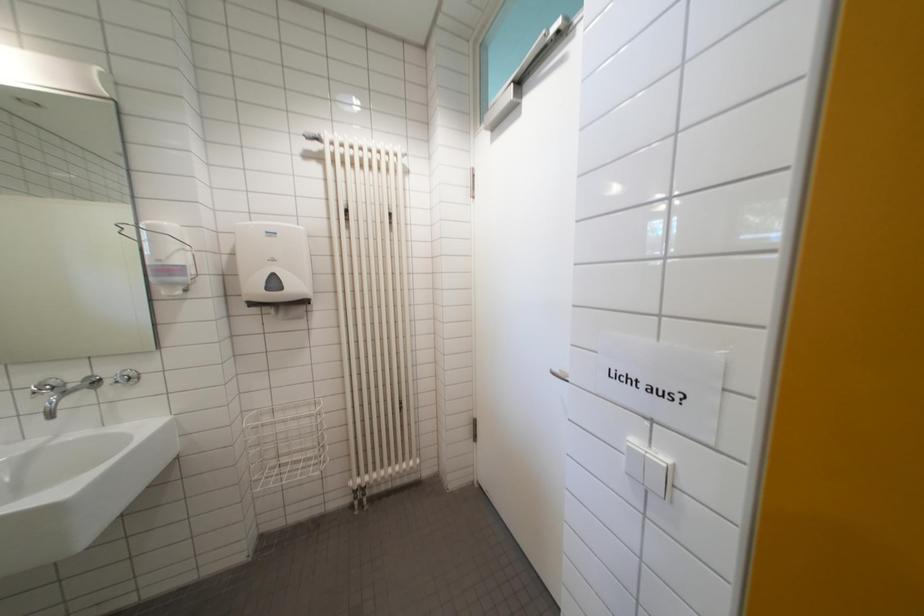
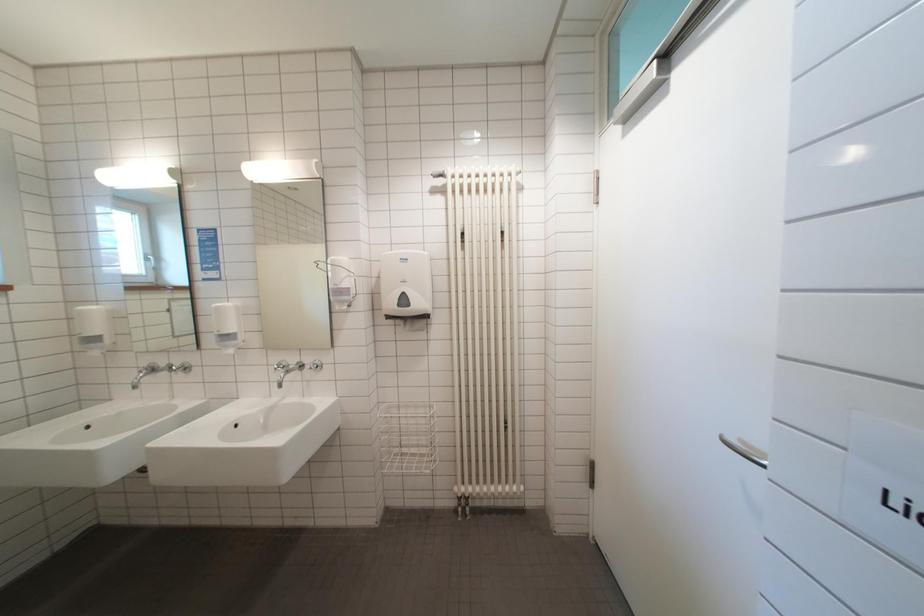
Question: The first image is from the beginning of the video and the second image is from the end. How did the camera likely rotate when shooting the video?

Choices:
 (A) Left
 (B) Right
 (C) Up
 (D) Down

Answer: (A)